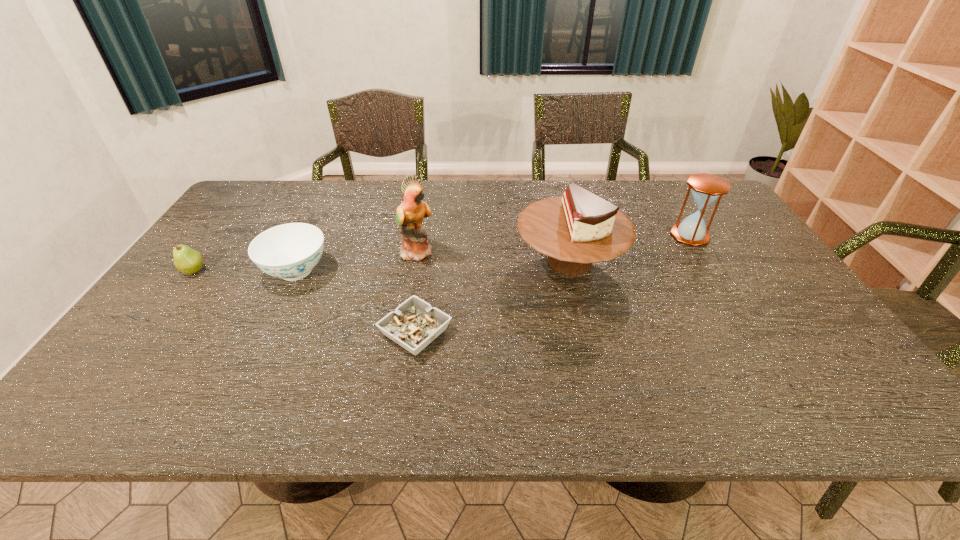
The height and width of the screenshot is (540, 960). I want to click on free spot between the cake and the shortest object, so click(492, 296).

Where is `free spot between the second object from left to right and the ashtray`? This screenshot has width=960, height=540. free spot between the second object from left to right and the ashtray is located at coordinates (356, 301).

The image size is (960, 540). Find the location of `vacant space that is in between the nearest object and the fifth object from left to right`. vacant space that is in between the nearest object and the fifth object from left to right is located at coordinates pos(492,296).

Find the location of a particular element. This screenshot has height=540, width=960. vacant point located between the tallest object and the ashtray is located at coordinates (417, 292).

You are a GUI agent. You are given a task and a screenshot of the screen. Output one action in this format:
    pyautogui.click(x=<x>, y=<y>)
    Task: Click on the vacant area that lies between the leftmost object and the shortest object
    This screenshot has height=540, width=960.
    Given the screenshot: What is the action you would take?
    pyautogui.click(x=304, y=301)

The image size is (960, 540). In order to click on empty space between the fifth object from right to left and the tallest object in this screenshot , I will do `click(357, 261)`.

At what (x,y) coordinates should I click in order to perform the action: click on unoccupied area between the parrot and the ashtray. Please return your answer as a coordinate pair (x, y). The width and height of the screenshot is (960, 540). Looking at the image, I should click on (417, 292).

Locate an element on the screen. The image size is (960, 540). vacant space that is in between the chinaware and the parrot is located at coordinates (357, 261).

This screenshot has width=960, height=540. Identify the location of empty space that is in between the pear and the second object from right to left. (382, 266).

Locate which object is the fourth closest to the cake. Please provide its 2D coordinates. Your answer should be formatted as a tuple, i.e. [(x, y)], where the tuple contains the x and y coordinates of a point satisfying the conditions above.

[(290, 251)]